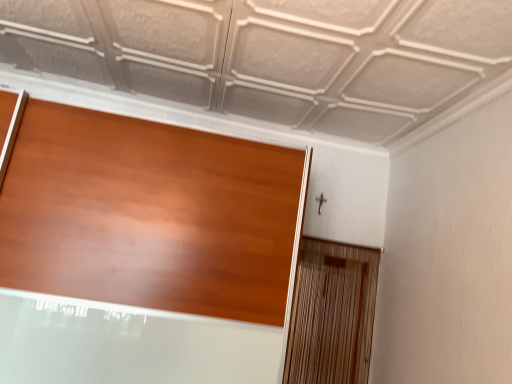
Question: Is matte wood door at center to the left of wooden screen door at right from the viewer's perspective?

Choices:
 (A) yes
 (B) no

Answer: (A)

Question: Can you confirm if matte wood door at center is bigger than wooden screen door at right?

Choices:
 (A) no
 (B) yes

Answer: (B)

Question: From a real-world perspective, is matte wood door at center positioned over wooden screen door at right based on gravity?

Choices:
 (A) yes
 (B) no

Answer: (A)

Question: Is the depth of matte wood door at center greater than that of wooden screen door at right?

Choices:
 (A) yes
 (B) no

Answer: (B)

Question: Is matte wood door at center outside of wooden screen door at right?

Choices:
 (A) no
 (B) yes

Answer: (B)

Question: Is wooden screen door at right at the back of matte wood door at center?

Choices:
 (A) yes
 (B) no

Answer: (B)

Question: Does wooden screen door at right appear on the left side of matte wood door at center?

Choices:
 (A) yes
 (B) no

Answer: (B)

Question: Would you say wooden screen door at right is a long distance from matte wood door at center?

Choices:
 (A) yes
 (B) no

Answer: (B)

Question: Can you confirm if wooden screen door at right is wider than matte wood door at center?

Choices:
 (A) no
 (B) yes

Answer: (A)

Question: Is the position of wooden screen door at right more distant than that of matte wood door at center?

Choices:
 (A) yes
 (B) no

Answer: (A)

Question: Considering the relative sizes of wooden screen door at right and matte wood door at center in the image provided, is wooden screen door at right shorter than matte wood door at center?

Choices:
 (A) yes
 (B) no

Answer: (A)

Question: From the image's perspective, would you say wooden screen door at right is positioned over matte wood door at center?

Choices:
 (A) yes
 (B) no

Answer: (B)

Question: Is wooden screen door at right inside or outside of matte wood door at center?

Choices:
 (A) inside
 (B) outside

Answer: (B)